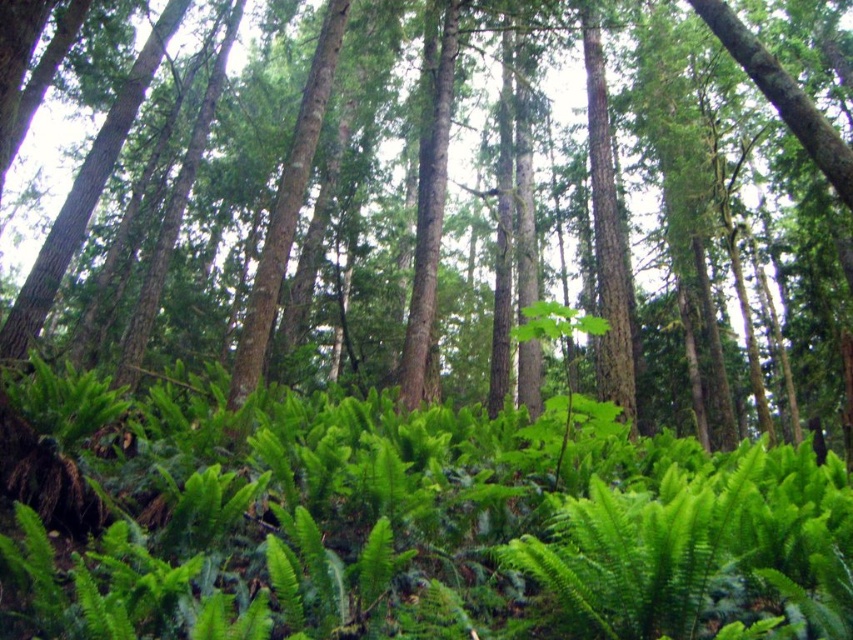
You are a botanist examining two ferns in the forest scene. The first is the green leafy fern at center, and the second is the green leafy fern at lower center. Which of these ferns takes up more area in the image?

The green leafy fern at lower center takes up more area in the image because it occupies more space than the green leafy fern at center.

You are a hiker who wants to step between the green leafy fern at center and the green leafy fern at lower center. Can you walk between them?

The green leafy fern at center is positioned on the right side of green leafy fern at lower center, so there is space between them for you to walk through.